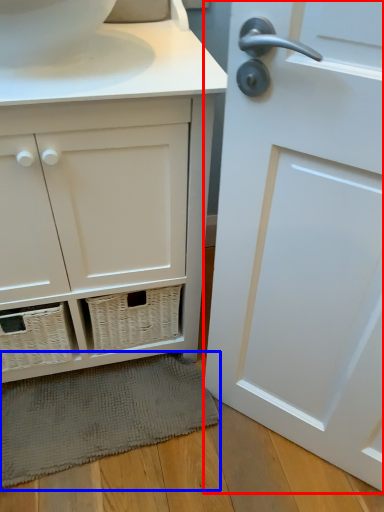
Question: Among these objects, which one is nearest to the camera, door (highlighted by a red box) or bath mat (highlighted by a blue box)?

Choices:
 (A) door
 (B) bath mat

Answer: (A)